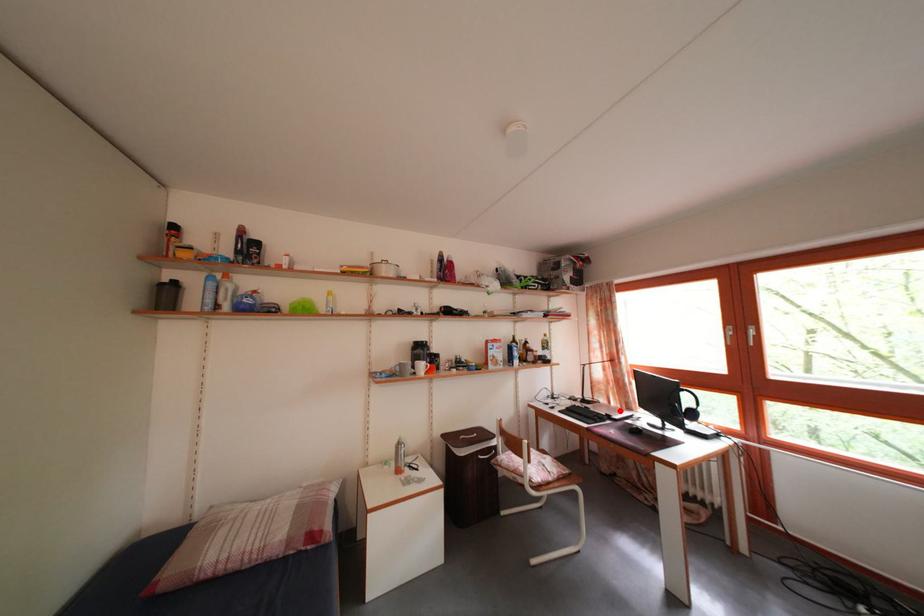
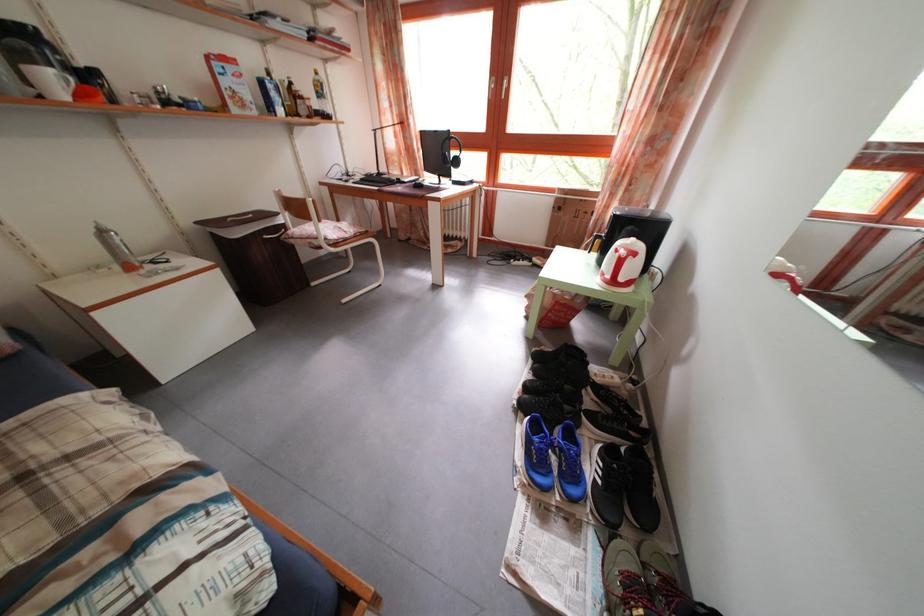
Question: I am providing you with two images of the same scene from different viewpoints. In image1, a red point is highlighted. Considering the same 3D point in image2, which of the following is correct?

Choices:
 (A) It is closer
 (B) It is farther

Answer: (A)